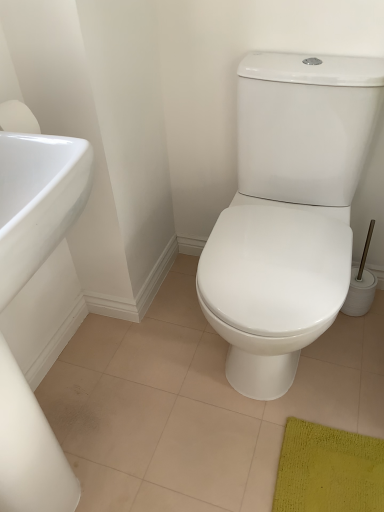
Question: Is white glossy toilet at center at the left side of white glossy sink at left?

Choices:
 (A) no
 (B) yes

Answer: (A)

Question: From the image's perspective, is white glossy toilet at center located above white glossy sink at left?

Choices:
 (A) no
 (B) yes

Answer: (B)

Question: Is white glossy toilet at center positioned before white glossy sink at left?

Choices:
 (A) yes
 (B) no

Answer: (B)

Question: From the image's perspective, is white glossy toilet at center under white glossy sink at left?

Choices:
 (A) yes
 (B) no

Answer: (B)

Question: Is white glossy toilet at center positioned with its back to white glossy sink at left?

Choices:
 (A) no
 (B) yes

Answer: (A)

Question: Can you confirm if white glossy toilet at center is shorter than white glossy sink at left?

Choices:
 (A) no
 (B) yes

Answer: (B)

Question: Can you confirm if white glossy sink at left is positioned to the right of white glossy toilet at center?

Choices:
 (A) no
 (B) yes

Answer: (A)

Question: Is white glossy sink at left not inside white glossy toilet at center?

Choices:
 (A) no
 (B) yes

Answer: (B)

Question: Is the position of white glossy sink at left more distant than that of white glossy toilet at center?

Choices:
 (A) no
 (B) yes

Answer: (A)

Question: Is white glossy sink at left wider than white glossy toilet at center?

Choices:
 (A) no
 (B) yes

Answer: (A)

Question: Is white glossy sink at left aimed at white glossy toilet at center?

Choices:
 (A) yes
 (B) no

Answer: (B)

Question: Is white glossy toilet at center a part of white glossy sink at left?

Choices:
 (A) yes
 (B) no

Answer: (B)

Question: Does point (278, 375) appear closer or farther from the camera than point (6, 392)?

Choices:
 (A) closer
 (B) farther

Answer: (B)